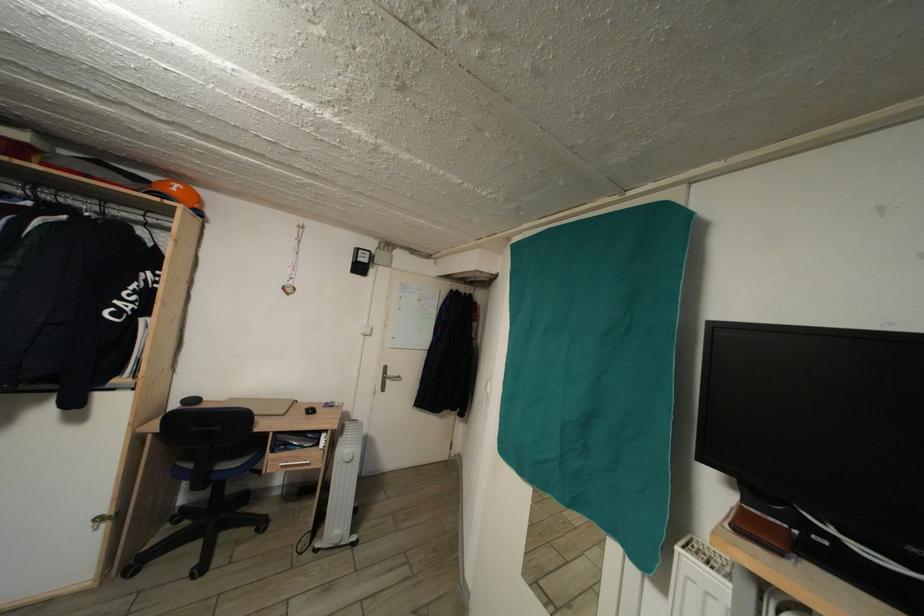
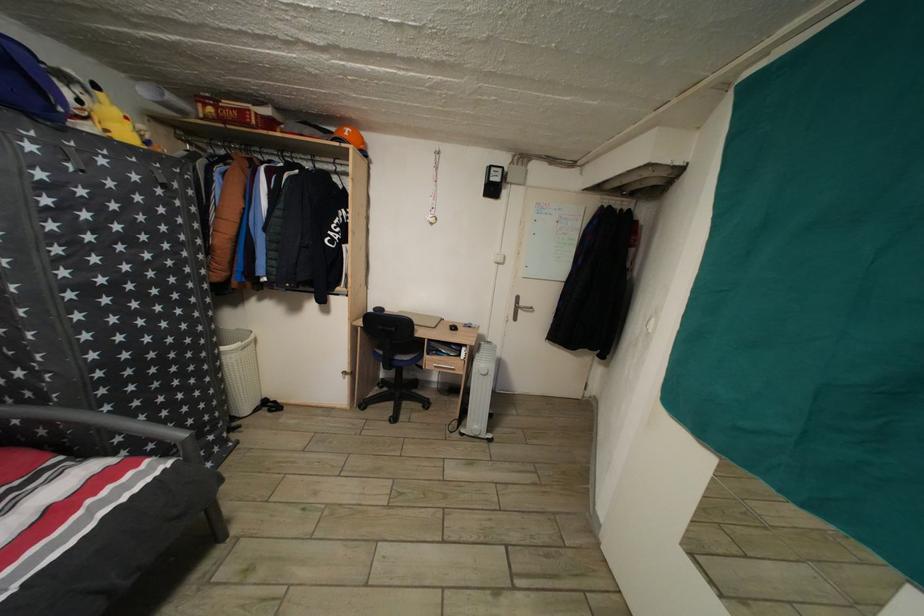
In the second image, find the point that corresponds to point (180, 196) in the first image.

(354, 140)